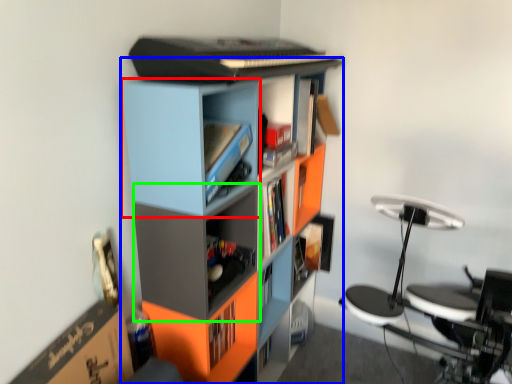
Question: Which is farther away from cabinet (highlighted by a red box)? bookcase (highlighted by a blue box) or shelf (highlighted by a green box)?

Choices:
 (A) bookcase
 (B) shelf

Answer: (B)